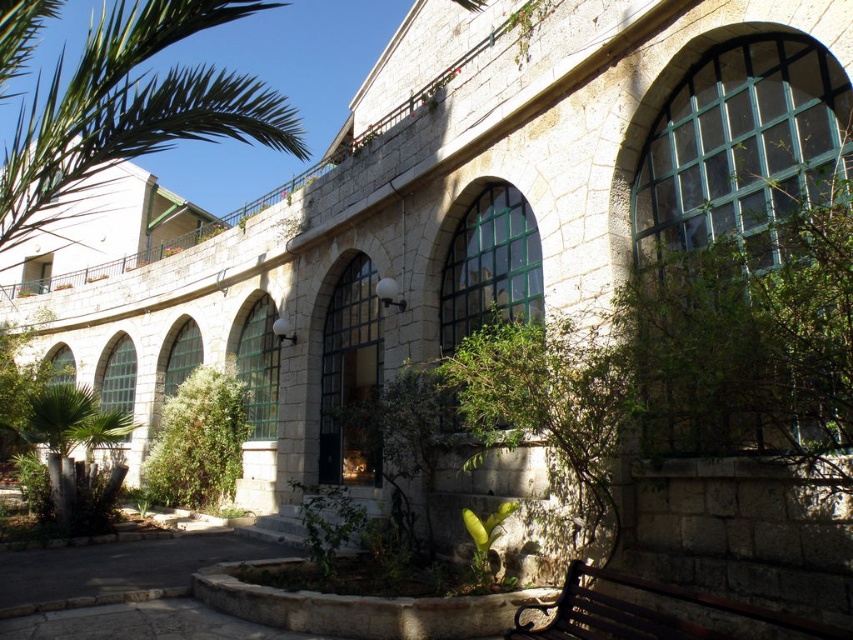
You are a visitor standing in front of the stone building. You want to sit down on the dark brown wooden bench at lower right but first need to pass by the green leafy palm at upper left. Which object will you encounter first as you approach the bench?

The green leafy palm at upper left will be encountered first because it is closer to the viewer than the dark brown wooden bench at lower right.

From the picture: You are standing at the entrance of the stone building and want to locate the green leafy palm at upper left. According to the coordinates provided, where should you look relative to the building?

The green leafy palm at upper left is located at coordinates point (x=132, y=108), which places it near the top left corner of the image, so you should look towards the upper left area relative to the building.